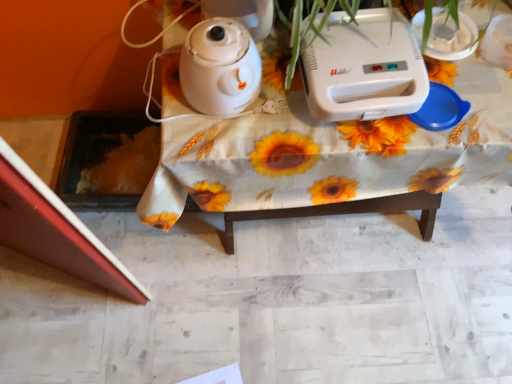
You are a GUI agent. You are given a task and a screenshot of the screen. Output one action in this format:
    pyautogui.click(x=<x>, y=<y>)
    Task: Click on the vacant area that lies to the right of white glossy kettle at upper center
    
    Given the screenshot: What is the action you would take?
    pyautogui.click(x=287, y=102)